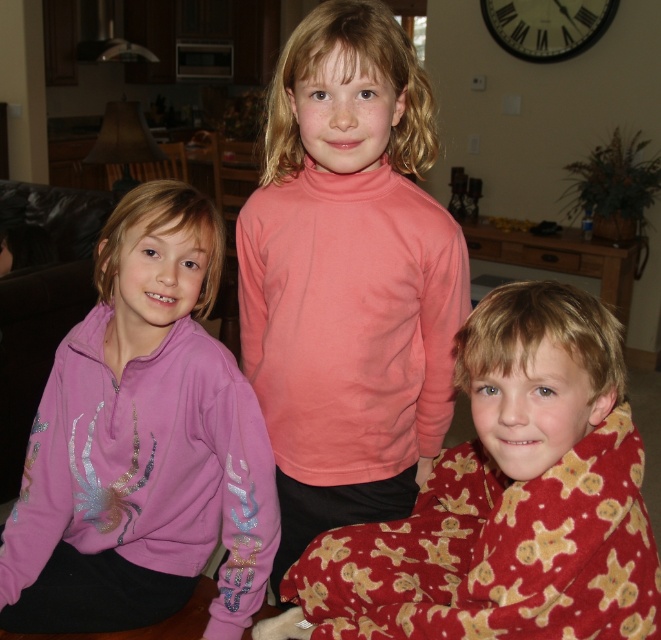
Question: Which of the following is the farthest from the observer?

Choices:
 (A) (186, 296)
 (B) (623, 408)
 (C) (364, 516)

Answer: (C)

Question: Where is pink matte turtleneck at center located in relation to pink glittery hoodie at left in the image?

Choices:
 (A) above
 (B) below

Answer: (A)

Question: Does pink matte turtleneck at center appear on the left side of fluffy red pajamas at lower right?

Choices:
 (A) no
 (B) yes

Answer: (B)

Question: Which point is closer to the camera taking this photo?

Choices:
 (A) (128, 596)
 (B) (266, 340)

Answer: (B)

Question: Based on their relative distances, which object is nearer to the pink glittery hoodie at left?

Choices:
 (A) fluffy red pajamas at lower right
 (B) pink matte turtleneck at center

Answer: (B)

Question: Is pink matte turtleneck at center to the right of fluffy red pajamas at lower right from the viewer's perspective?

Choices:
 (A) yes
 (B) no

Answer: (B)